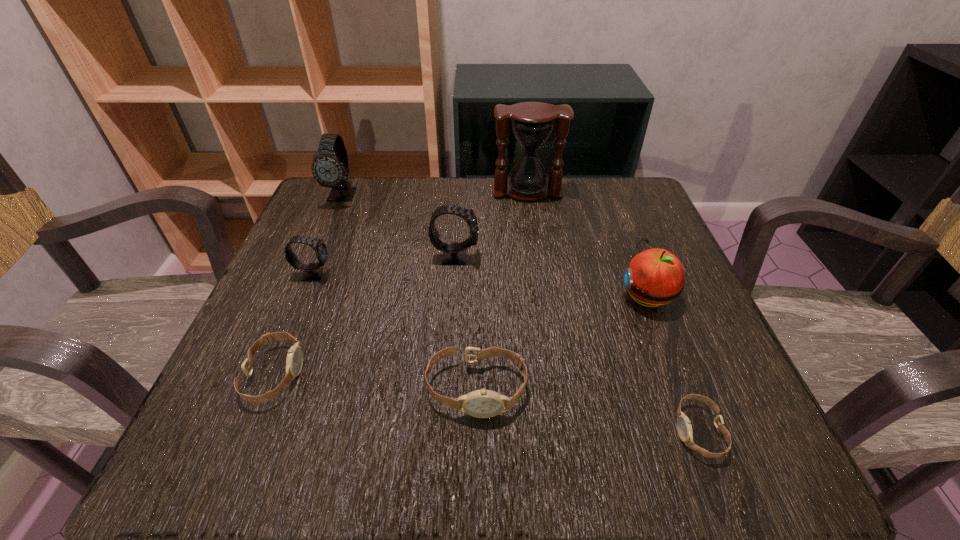
The image size is (960, 540). I want to click on hourglass, so click(532, 123).

Image resolution: width=960 pixels, height=540 pixels. I want to click on brown hourglass, so tap(532, 123).

Locate an element on the screen. The image size is (960, 540). the tallest watch is located at coordinates (330, 167).

Locate an element on the screen. the farthest watch is located at coordinates [330, 167].

Where is `the rightmost gray watch`? the rightmost gray watch is located at coordinates (455, 253).

At what (x,y) coordinates should I click in order to perform the action: click on the third farthest object. Please return your answer as a coordinate pair (x, y). This screenshot has width=960, height=540. Looking at the image, I should click on (455, 253).

Image resolution: width=960 pixels, height=540 pixels. I want to click on apple, so click(654, 277).

The image size is (960, 540). I want to click on the nearest gray watch, so click(x=312, y=272).

This screenshot has width=960, height=540. What are the coordinates of `the smallest gray watch` in the screenshot? It's located at (312, 272).

Identify the location of the second beige watch from left to right. (x=483, y=403).